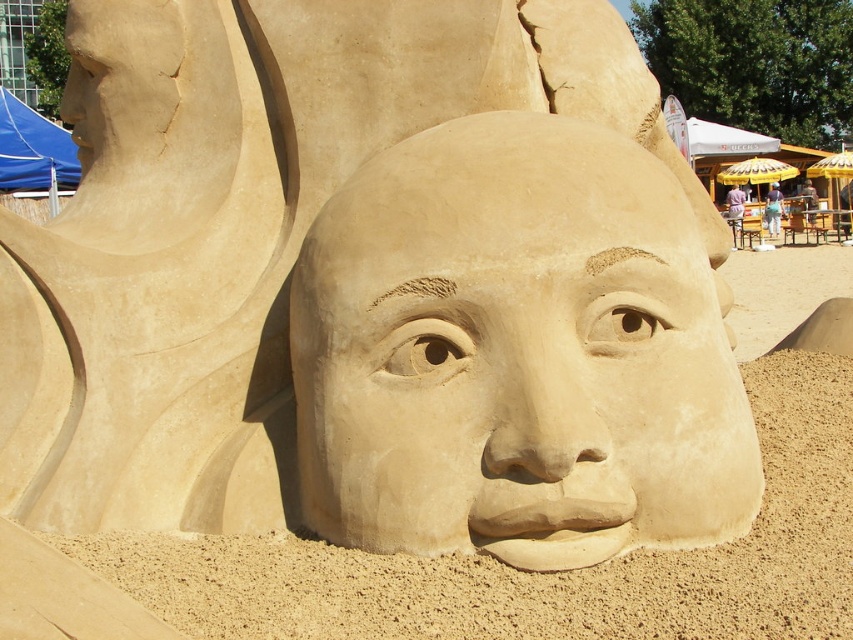
Which is behind, point (558, 284) or point (173, 572)?

The point (558, 284) is behind.

Can you confirm if smooth sand sculpture at center is thinner than smooth sand face at center?

Correct, smooth sand sculpture at center's width is less than smooth sand face at center's.

What do you see at coordinates (515, 353) in the screenshot?
I see `smooth sand sculpture at center` at bounding box center [515, 353].

Identify the location of smooth sand sculpture at center. (515, 353).